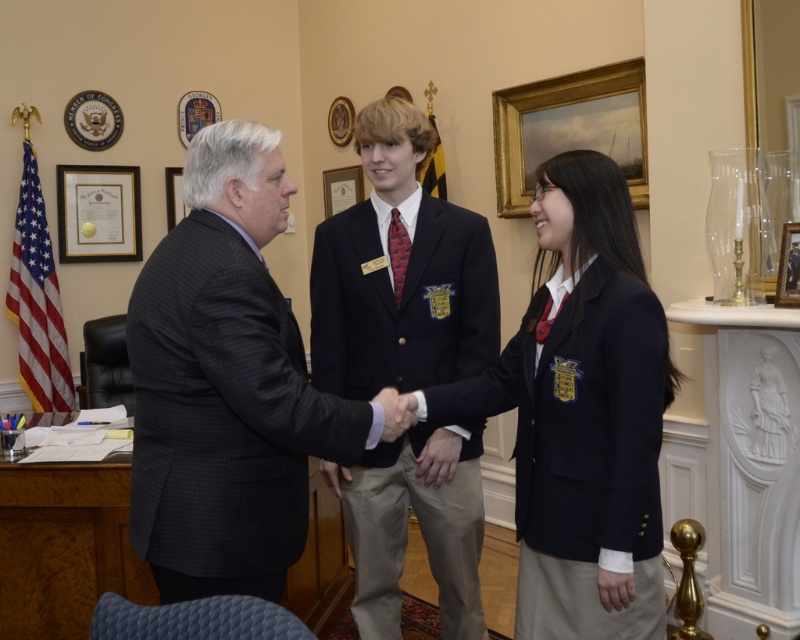
You are a photographer preparing to take a group photo of the dark gray suit at center and the wooden picture frame at center. The camera you are using has a maximum width capacity of 1.2 meters. Can both subjects fit within the camera frame without cropping?

The dark gray suit at center is wider than the wooden picture frame at center. Since the camera can accommodate up to 1.2 meters, but we don not know the exact combined width of both subjects, it is uncertain if they will fit without cropping.